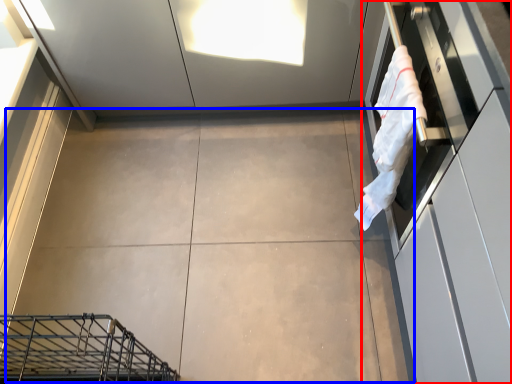
Question: Which object is closer to the camera taking this photo, cabinetry (highlighted by a red box) or concrete (highlighted by a blue box)?

Choices:
 (A) cabinetry
 (B) concrete

Answer: (A)